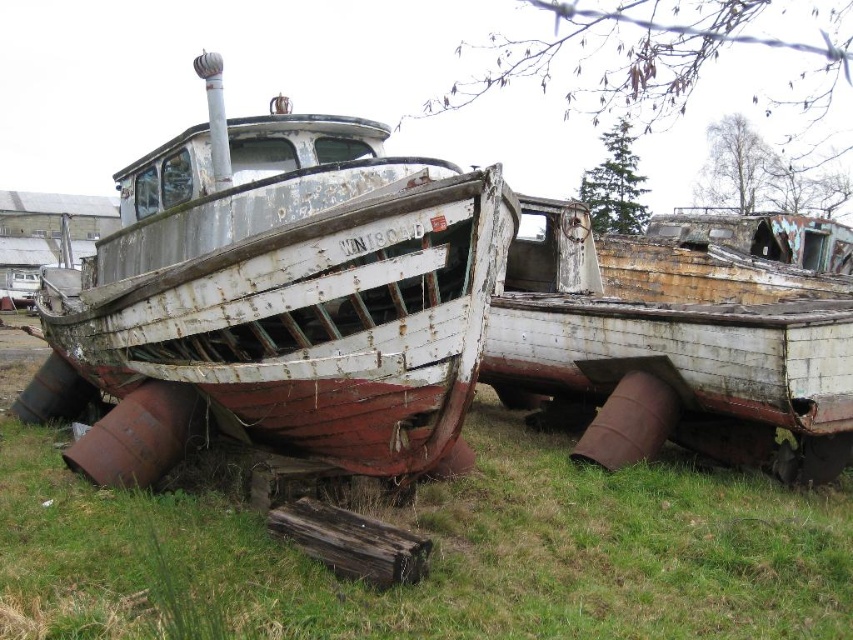
Question: Among these points, which one is farthest from the camera?

Choices:
 (A) (392, 324)
 (B) (738, 429)

Answer: (B)

Question: Is the position of rusty wood boat at center less distant than that of rusty metal boat at center?

Choices:
 (A) yes
 (B) no

Answer: (A)

Question: Is rusty wood boat at center below rusty metal boat at center?

Choices:
 (A) no
 (B) yes

Answer: (A)

Question: Among these objects, which one is farthest from the camera?

Choices:
 (A) rusty metal boat at center
 (B) rusty wood boat at center

Answer: (A)

Question: Where is rusty wood boat at center located in relation to rusty metal boat at center in the image?

Choices:
 (A) right
 (B) left

Answer: (B)